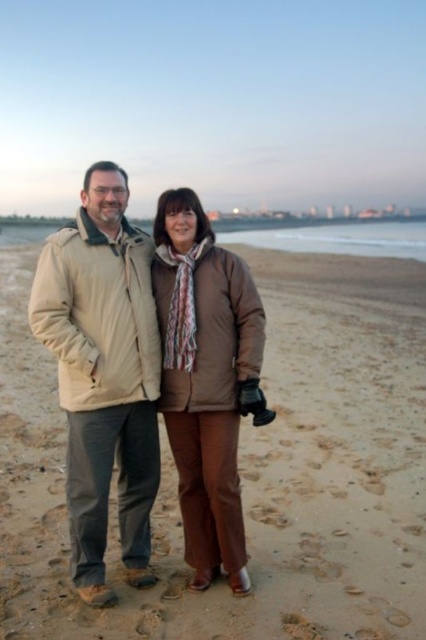
Is brown sand at center to the left of brown matte jacket at center from the viewer's perspective?

Yes, brown sand at center is to the left of brown matte jacket at center.

From the picture: Is brown sand at center shorter than brown matte jacket at center?

No, brown sand at center is not shorter than brown matte jacket at center.

Does point (368, 282) come behind point (198, 339)?

Yes, it is behind point (198, 339).

Find the location of `brown sand at center`. brown sand at center is located at coordinates (250, 470).

Is brown sand at center to the left of beige fabric jacket at center from the viewer's perspective?

No, brown sand at center is not to the left of beige fabric jacket at center.

Does point (52, 570) come farther from viewer compared to point (78, 340)?

Yes, point (52, 570) is farther from viewer.

Find the location of a particular element. This screenshot has width=426, height=640. brown sand at center is located at coordinates (250, 470).

Does beige fabric jacket at center come in front of brown matte jacket at center?

Yes, it is.

Is point (97, 490) positioned in front of point (166, 218)?

Yes, it is in front of point (166, 218).

I want to click on beige fabric jacket at center, so click(103, 374).